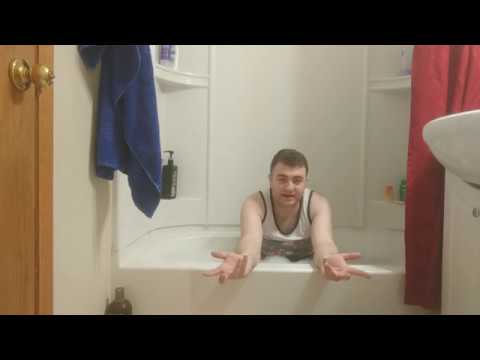
Where is `wooden door`? The width and height of the screenshot is (480, 360). wooden door is located at coordinates (17, 133).